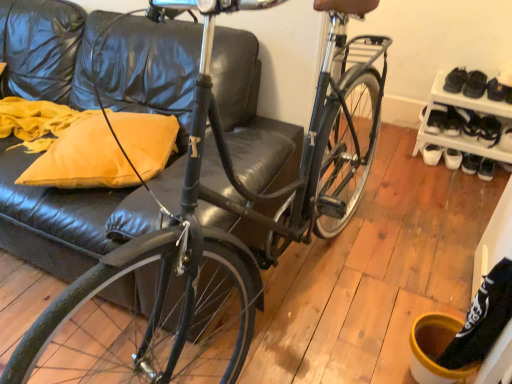
Question: Considering the positions of yellow fabric pillow at left and white plastic shoe rack at lower right in the image, is yellow fabric pillow at left wider or thinner than white plastic shoe rack at lower right?

Choices:
 (A) wide
 (B) thin

Answer: (A)

Question: From the image's perspective, relative to white plastic shoe rack at lower right, is yellow fabric pillow at left above or below?

Choices:
 (A) above
 (B) below

Answer: (B)

Question: Considering the real-world distances, which object is farthest from the white plastic shoe rack at lower right?

Choices:
 (A) yellow fabric pillow at left
 (B) black leather shoe at right, the second shoe when ordered from left to right
 (C) black leather shoe at right, the 1th shoe positioned from the left

Answer: (A)

Question: Estimate the real-world distances between objects in this image. Which object is farther from the white plastic shoe rack at lower right?

Choices:
 (A) black leather shoe at right, the second shoe when ordered from left to right
 (B) yellow fabric pillow at left
 (C) black leather shoe at right, the 2th shoe in the right-to-left sequence

Answer: (B)